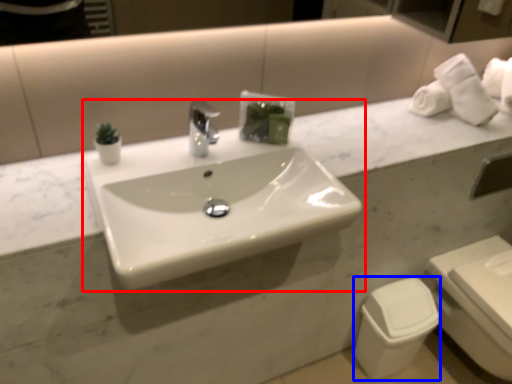
Question: Which point is closer to the camera, sink (highlighted by a red box) or toilet bowl (highlighted by a blue box)?

Choices:
 (A) sink
 (B) toilet bowl

Answer: (A)